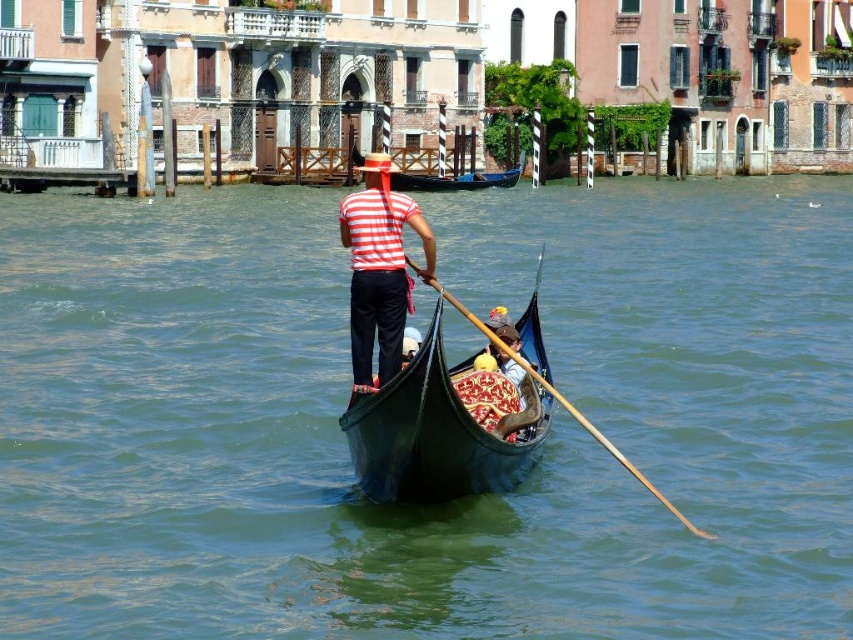
You are a tourist planning to take a ride on the canal. You see two vessels available for hire. The wooden at center and the black glossy canoe at center. Which vessel is narrower?

The wooden at center is thinner than the black glossy canoe at center, so the wooden at center is narrower.

You are standing on a bridge overlooking the canal and see two points in the water. The first point is labeled as point (457, 308) and the second is point (469, 179). Which point is closer to you?

Point (457, 308) is closer to the viewer than point (469, 179).

You are a tourist standing on the canal bridge and want to take a photo of the green water at center and the black glossy canoe at center. Which object should you focus on first if you want to capture both in one shot?

The green water at center is in front of the black glossy canoe at center, so you should focus on the green water at center first to ensure both are in focus.